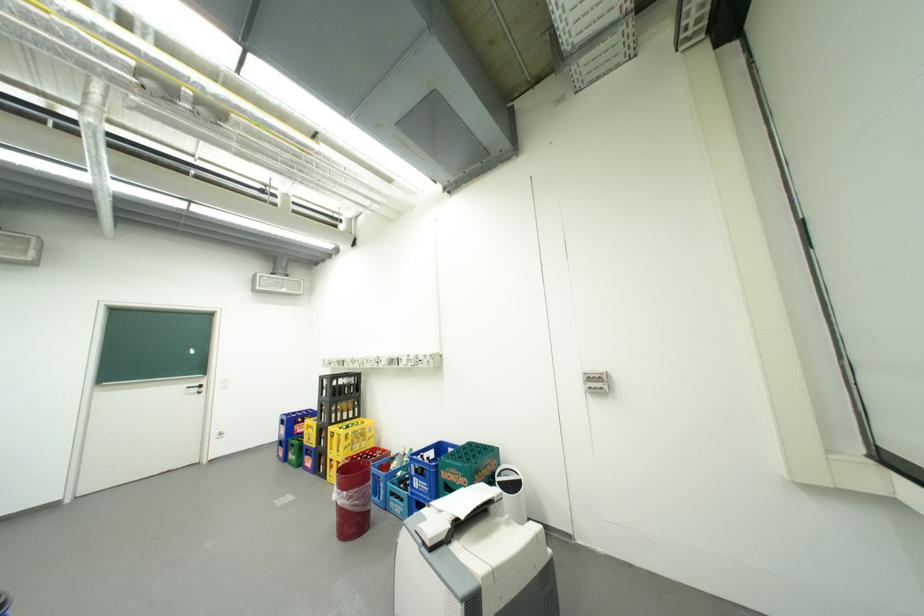
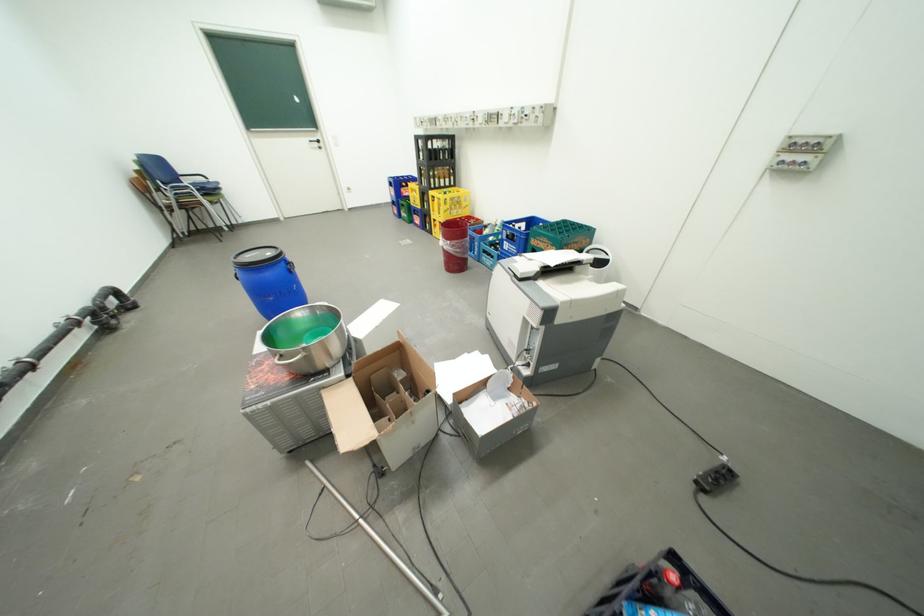
Where in the second image is the point corresponding to [356,493] from the first image?

(459, 243)